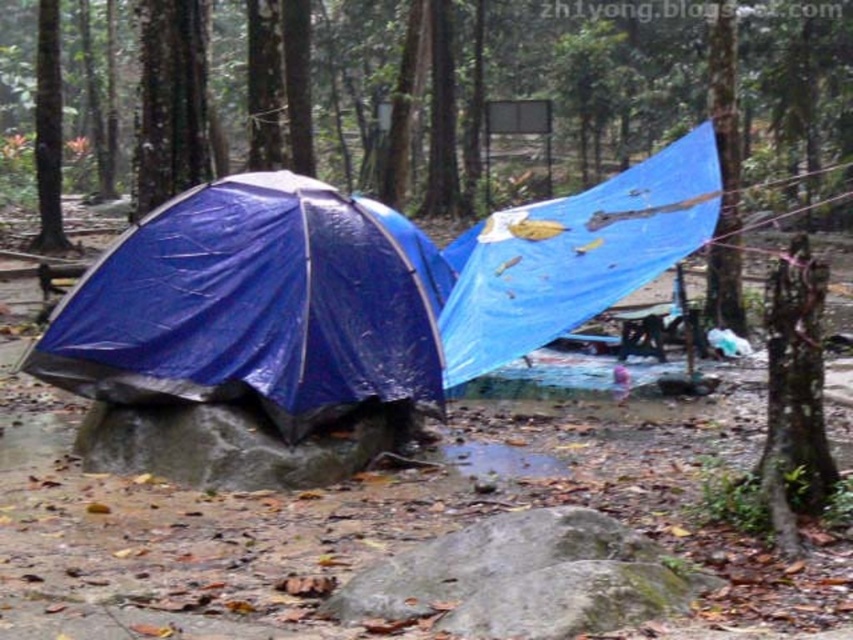
Can you confirm if blue tarpaulin tent at left is thinner than blue tarpaulin tent at center?

In fact, blue tarpaulin tent at left might be wider than blue tarpaulin tent at center.

Can you confirm if blue tarpaulin tent at left is wider than blue tarpaulin tent at center?

Yes.

Who is more distant from viewer, (242, 324) or (572, 259)?

The point (572, 259) is more distant.

Locate an element on the screen. The height and width of the screenshot is (640, 853). blue tarpaulin tent at left is located at coordinates (251, 307).